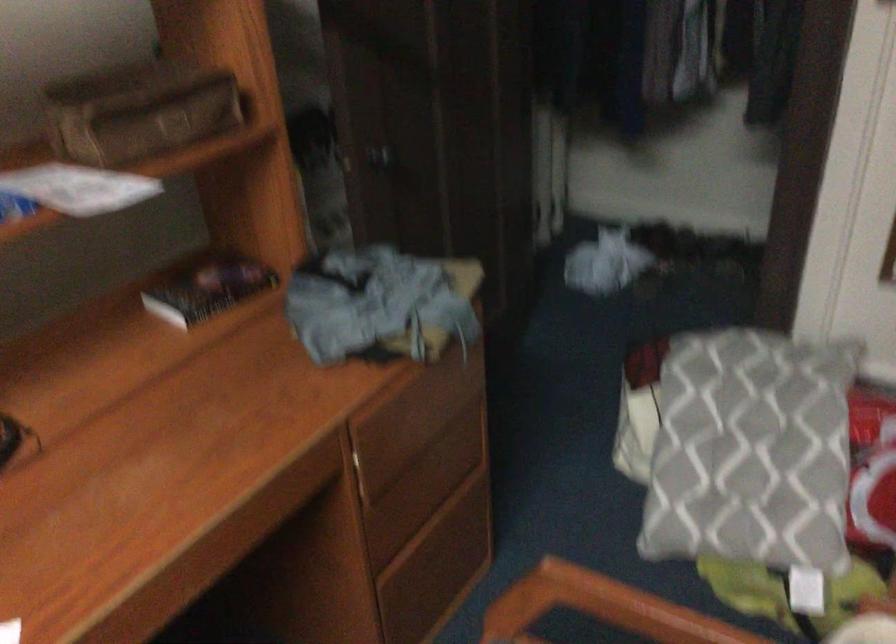
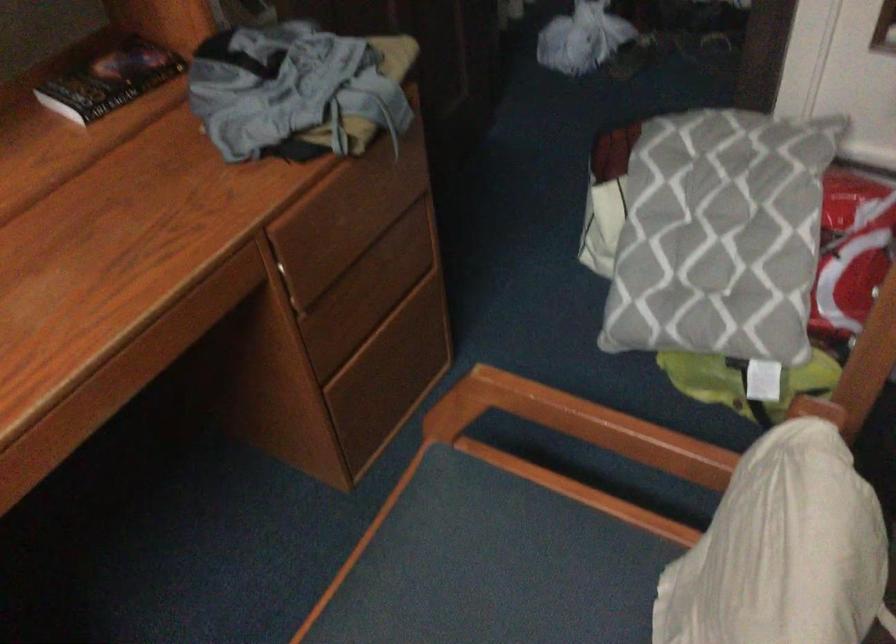
The point at (367, 473) is marked in the first image. Where is the corresponding point in the second image?

(299, 276)